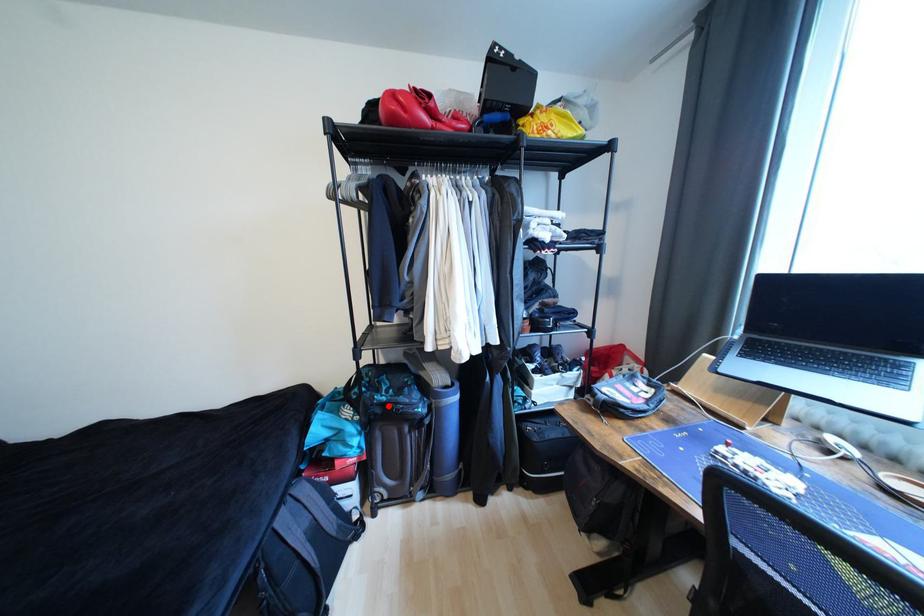
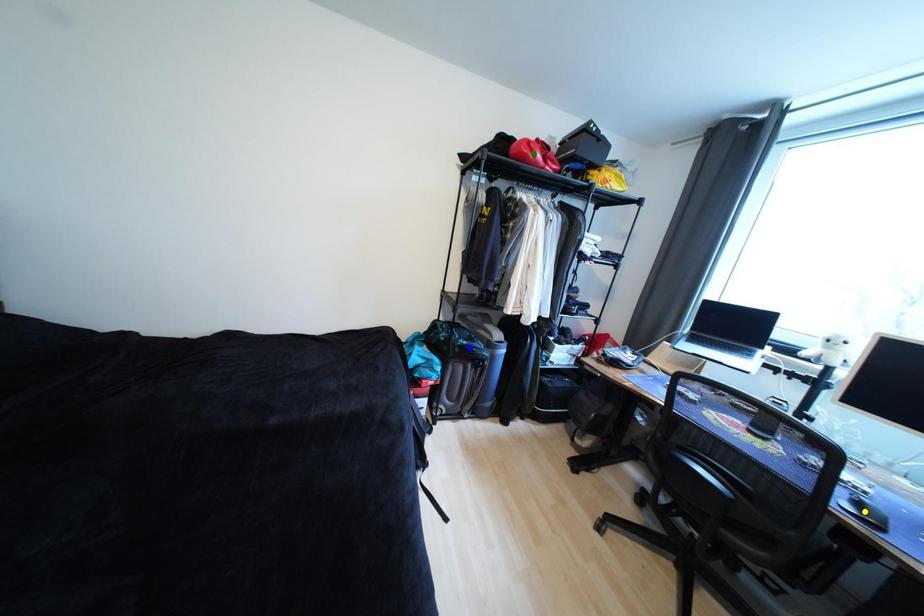
Question: I am providing you with two images of the same scene from different viewpoints. A red point is marked on the first image. You are given multiple points on the second image. Which spot in image 2 lines up with the point in image 1?

Choices:
 (A) blue point
 (B) green point
 (C) yellow point

Answer: (A)